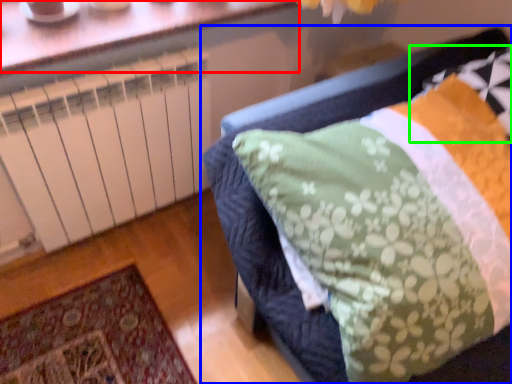
Question: Estimate the real-world distances between objects in this image. Which object is farther from window (highlighted by a red box), furniture (highlighted by a blue box) or pillow (highlighted by a green box)?

Choices:
 (A) furniture
 (B) pillow

Answer: (B)